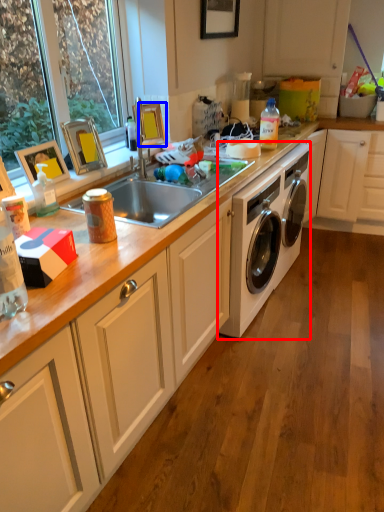
Question: Which point is closer to the camera, washing machine (highlighted by a red box) or picture frame (highlighted by a blue box)?

Choices:
 (A) washing machine
 (B) picture frame

Answer: (B)